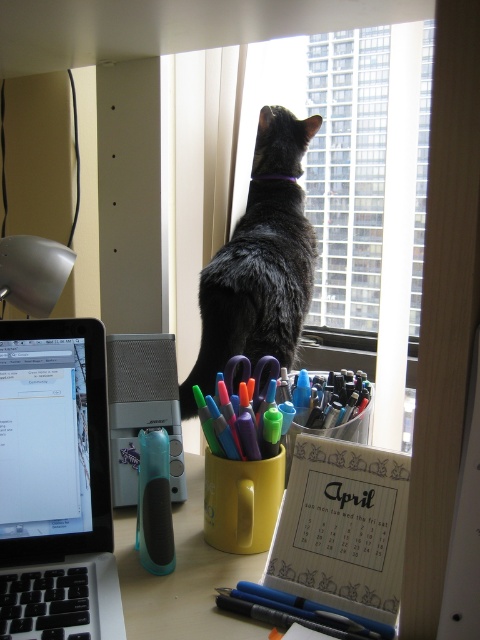
Question: Among these points, which one is nearest to the camera?

Choices:
 (A) (313, 124)
 (B) (0, 561)

Answer: (B)

Question: Is silver metallic laptop at left positioned before matte plastic cup at center?

Choices:
 (A) yes
 (B) no

Answer: (A)

Question: Does black fur cat at center appear on the left side of matte black pen at lower center?

Choices:
 (A) yes
 (B) no

Answer: (A)

Question: Based on their relative distances, which object is farther from the teal rubberized eraser at center?

Choices:
 (A) silver metallic laptop at left
 (B) black fur cat at center
 (C) matte black pen at lower center
 (D) matte plastic cup at center

Answer: (B)

Question: Is black fur cat at center above matte plastic cup at center?

Choices:
 (A) yes
 (B) no

Answer: (A)

Question: Among these points, which one is nearest to the camera?

Choices:
 (A) (79, 419)
 (B) (264, 141)
 (C) (140, 513)

Answer: (A)